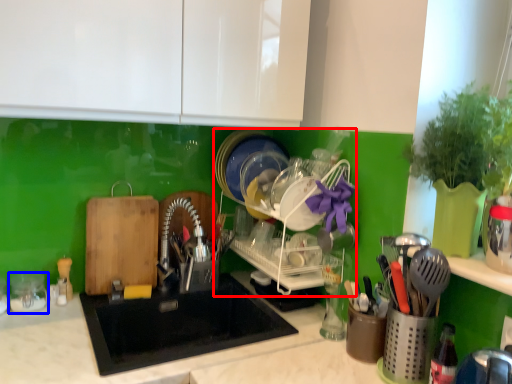
Question: Which object is further to the camera taking this photo, dish washer (highlighted by a red box) or tableware (highlighted by a blue box)?

Choices:
 (A) dish washer
 (B) tableware

Answer: (B)